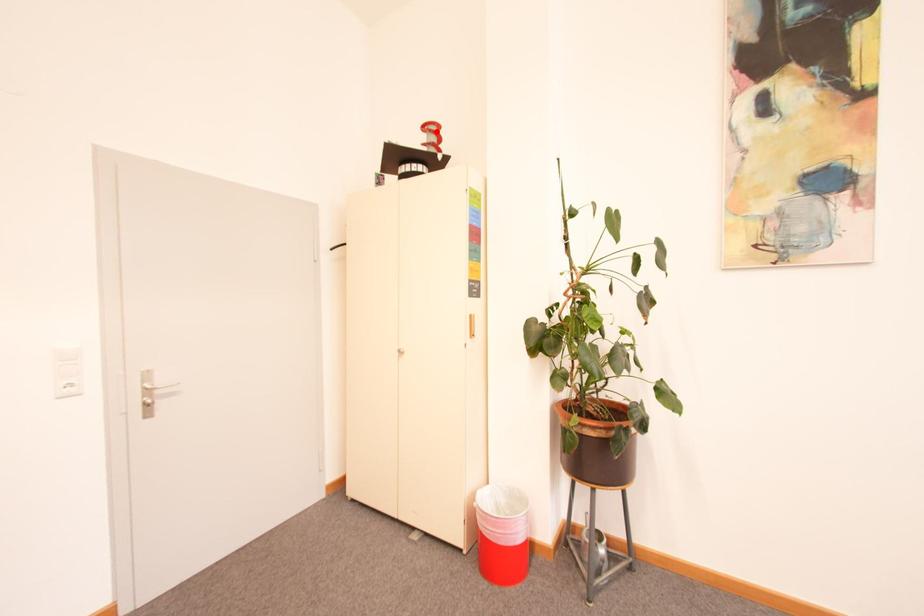
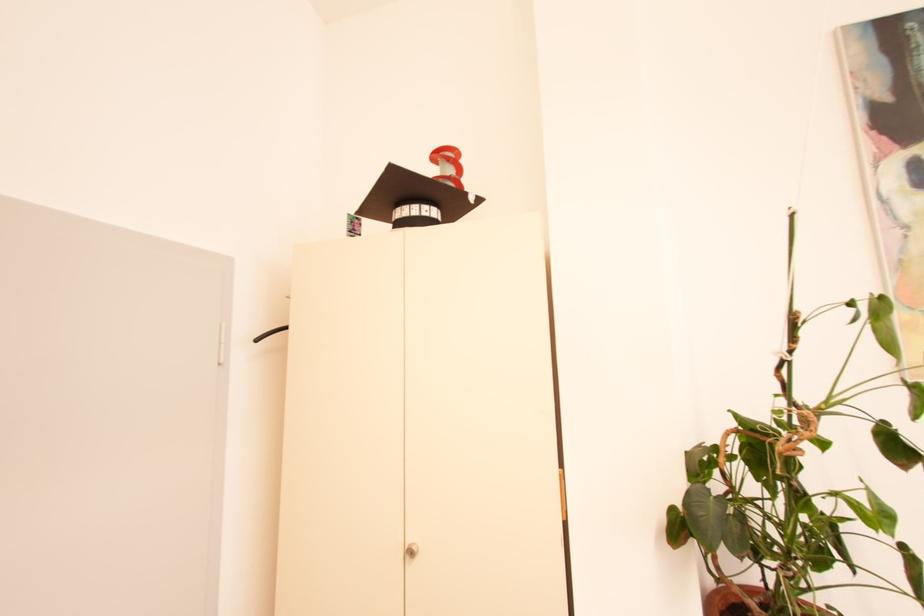
In the second image, find the point that corresponds to the highlighted location in the first image.

(455, 160)